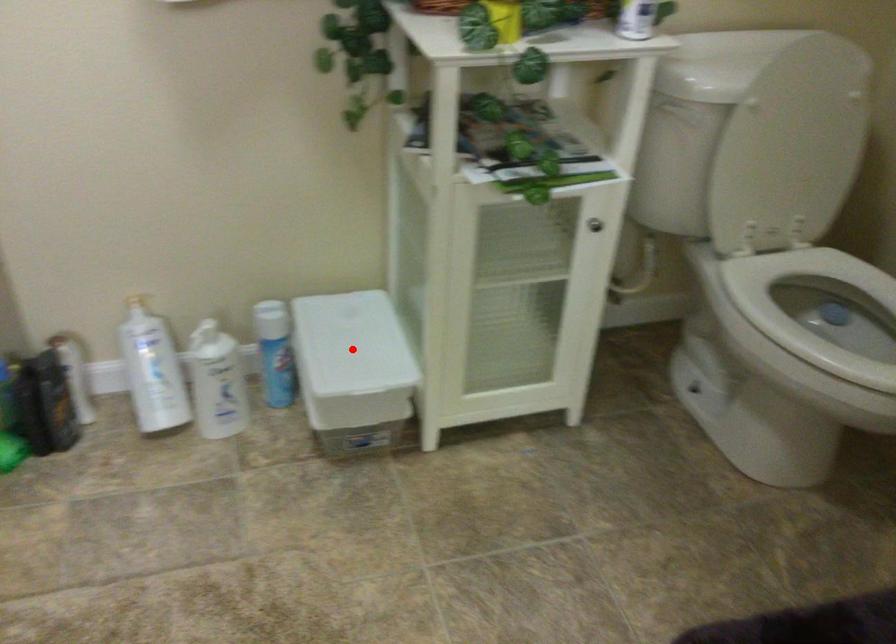
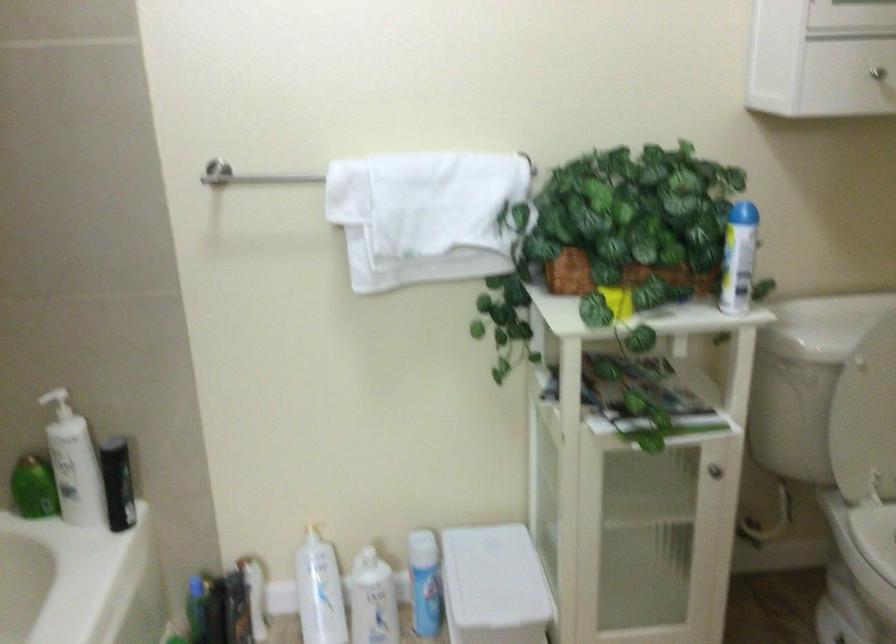
Find the pixel in the second image that matches the highlighted location in the first image.

(493, 580)